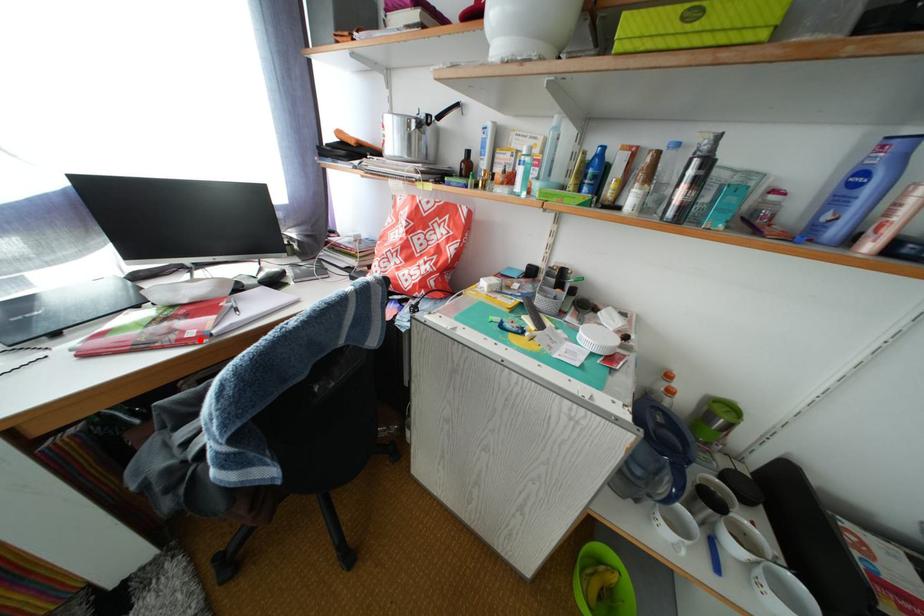
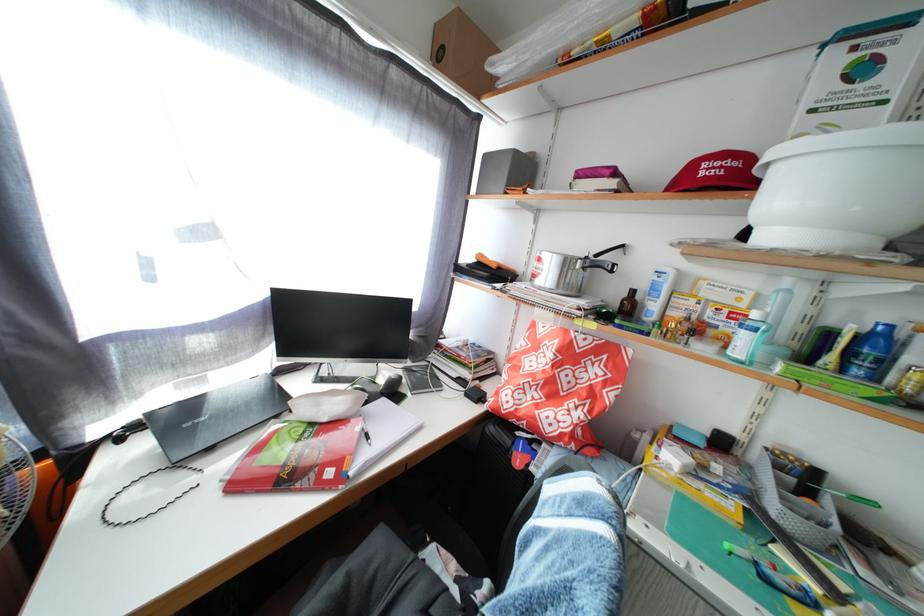
Where in the second image is the point corresponding to the highlighted location from the first image?

(338, 480)